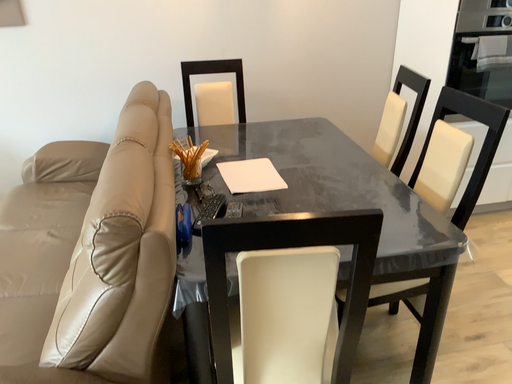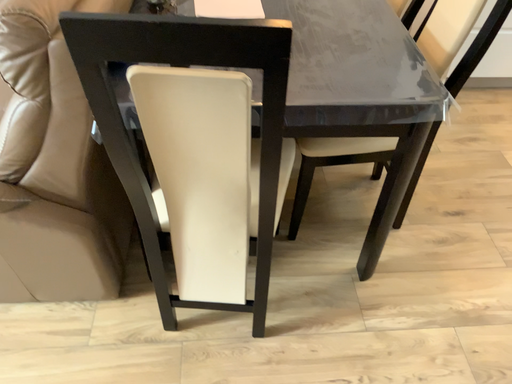
Question: How did the camera likely rotate when shooting the video?

Choices:
 (A) rotated upward
 (B) rotated downward

Answer: (B)